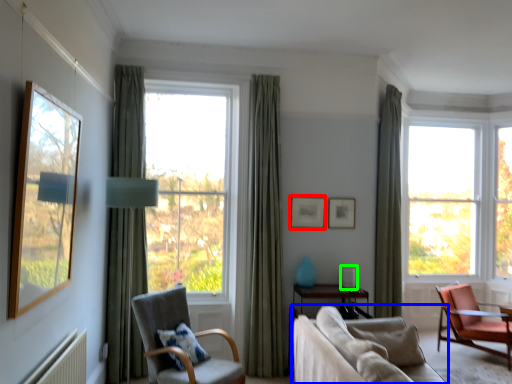
Question: Which is farther away from picture frame (highlighted by a red box)? studio couch (highlighted by a blue box) or table lamp (highlighted by a green box)?

Choices:
 (A) studio couch
 (B) table lamp

Answer: (A)